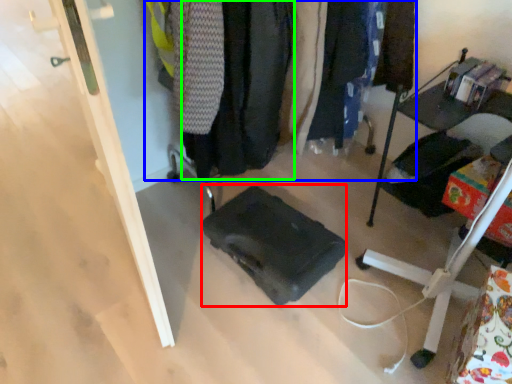
Question: Estimate the real-world distances between objects in this image. Which object is closer to luggage (highlighted by a red box), closet (highlighted by a blue box) or clothing (highlighted by a green box)?

Choices:
 (A) closet
 (B) clothing

Answer: (B)